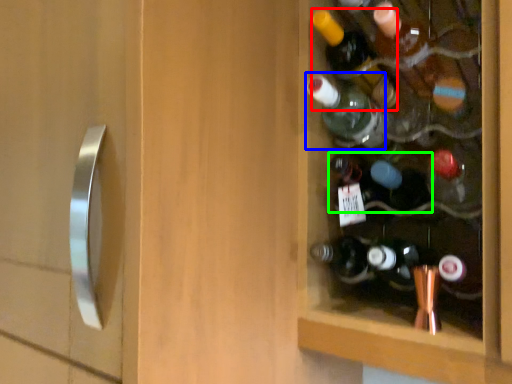
Question: Which object is the closest to the bottle (highlighted by a red box)? Choose among these: bottle (highlighted by a blue box) or bottle (highlighted by a green box).

Choices:
 (A) bottle
 (B) bottle

Answer: (A)